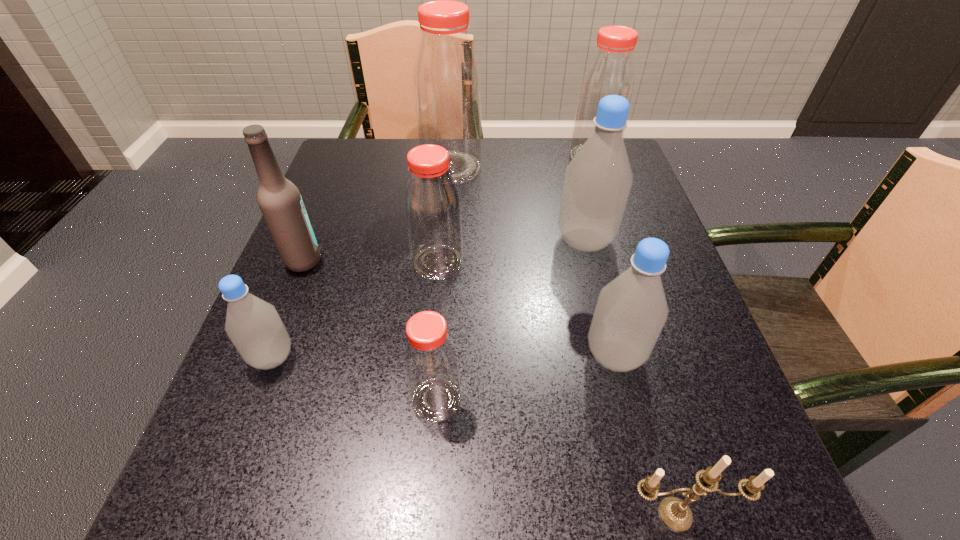
The height and width of the screenshot is (540, 960). I want to click on the biggest red bottle, so click(446, 77).

At what (x,y) coordinates should I click in order to perform the action: click on the tallest bottle. Please return your answer as a coordinate pair (x, y). This screenshot has width=960, height=540. Looking at the image, I should click on (446, 77).

This screenshot has height=540, width=960. Identify the location of the third smallest red bottle. 611,71.

In order to click on the farthest gray bottle in this screenshot , I will do `click(597, 182)`.

Identify the location of beer bottle. Image resolution: width=960 pixels, height=540 pixels. (280, 201).

Where is `the third biggest red bottle`? This screenshot has height=540, width=960. the third biggest red bottle is located at coordinates (432, 207).

Locate an element on the screen. This screenshot has width=960, height=540. the second biggest gray bottle is located at coordinates (631, 311).

The height and width of the screenshot is (540, 960). I want to click on the smallest red bottle, so click(430, 358).

The image size is (960, 540). What are the coordinates of `the smallest gray bottle` in the screenshot? It's located at (254, 326).

The height and width of the screenshot is (540, 960). I want to click on the leftmost bottle, so click(254, 326).